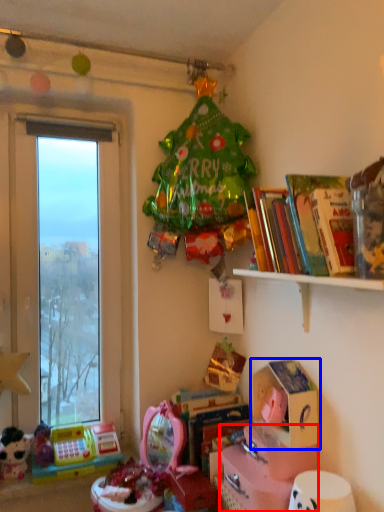
Question: Which object appears farthest to the camera in this image, cardboard box (highlighted by a red box) or cardboard box (highlighted by a blue box)?

Choices:
 (A) cardboard box
 (B) cardboard box

Answer: (B)